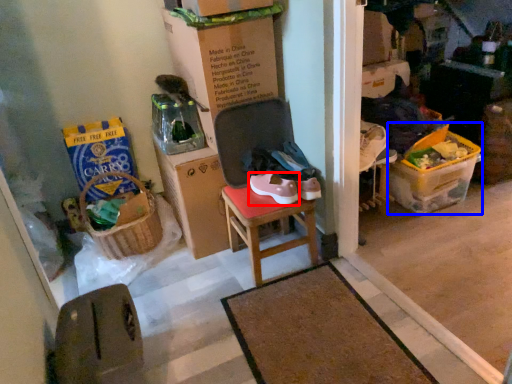
Question: Which object appears farthest to the camera in this image, footwear (highlighted by a red box) or box (highlighted by a blue box)?

Choices:
 (A) footwear
 (B) box

Answer: (B)